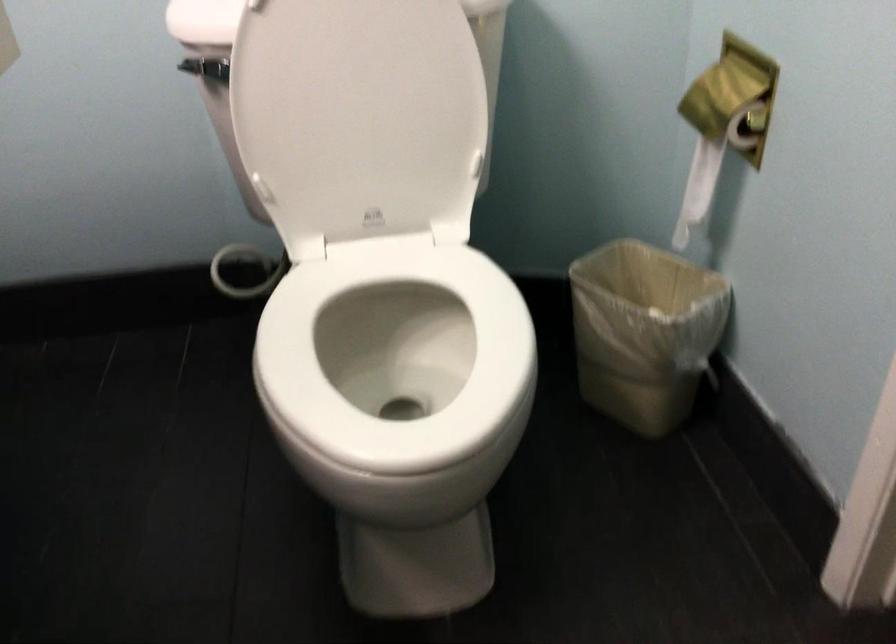
Find the location of `toilet paper roll`. toilet paper roll is located at coordinates (722, 91).